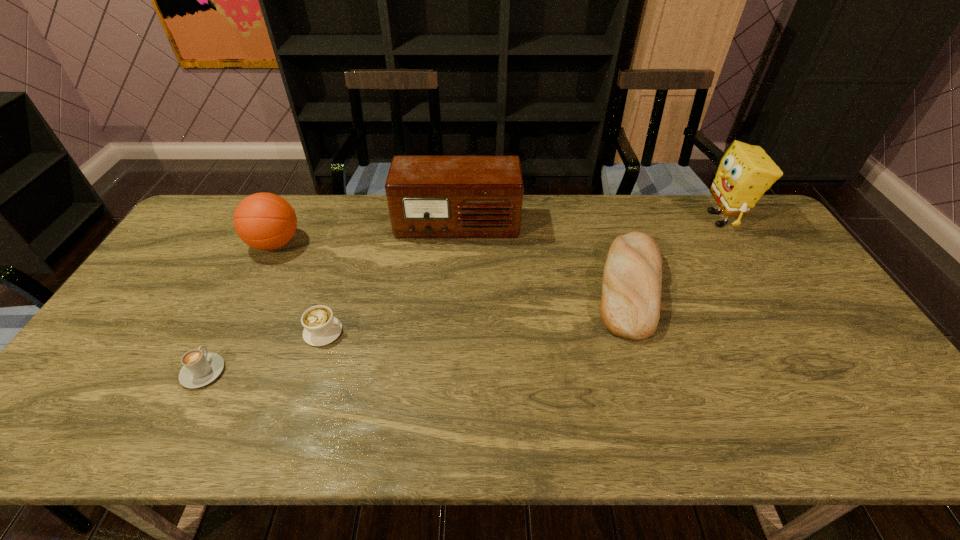
You are a GUI agent. You are given a task and a screenshot of the screen. Output one action in this format:
    pyautogui.click(x=<x>, y=<y>)
    Task: Click on the tallest object
    
    Given the screenshot: What is the action you would take?
    pyautogui.click(x=745, y=172)

Image resolution: width=960 pixels, height=540 pixels. What are the coordinates of `the rightmost object` in the screenshot? It's located at (745, 172).

Find the location of a particular element. the fourth object from left to right is located at coordinates (428, 196).

Locate an element on the screen. The height and width of the screenshot is (540, 960). radio receiver is located at coordinates (428, 196).

Where is `basketball`? basketball is located at coordinates (265, 221).

At what (x,y) coordinates should I click in order to perform the action: click on bread. Please return your answer as a coordinate pair (x, y). This screenshot has width=960, height=540. Looking at the image, I should click on (630, 304).

Identify the location of the fifth object from left to right. This screenshot has height=540, width=960. (630, 304).

Locate an element on the screen. The height and width of the screenshot is (540, 960). the farther cappuccino is located at coordinates (320, 327).

Where is `the fourth object from right to left`? The height and width of the screenshot is (540, 960). the fourth object from right to left is located at coordinates (320, 327).

Find the location of a particular element. Image resolution: width=960 pixels, height=540 pixels. the nearest object is located at coordinates (199, 369).